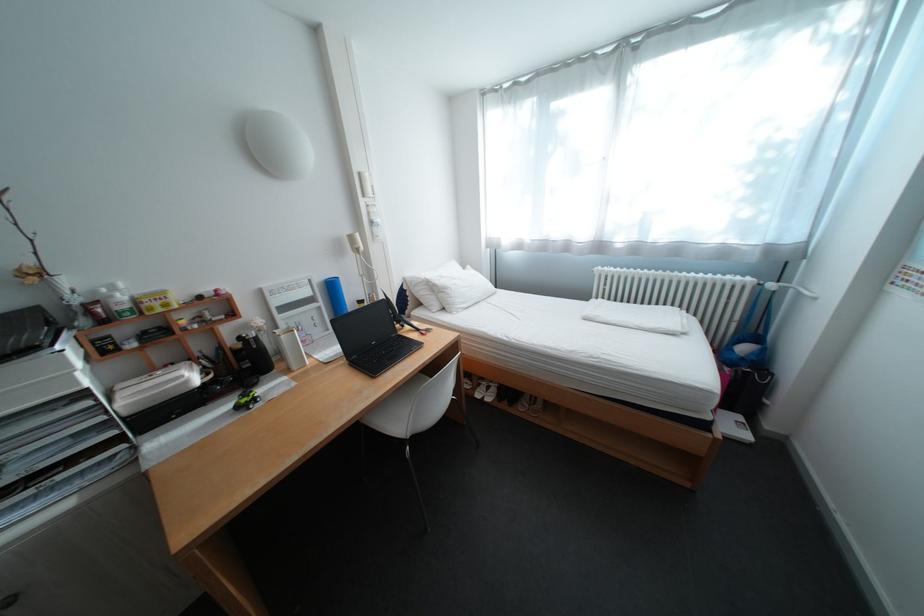
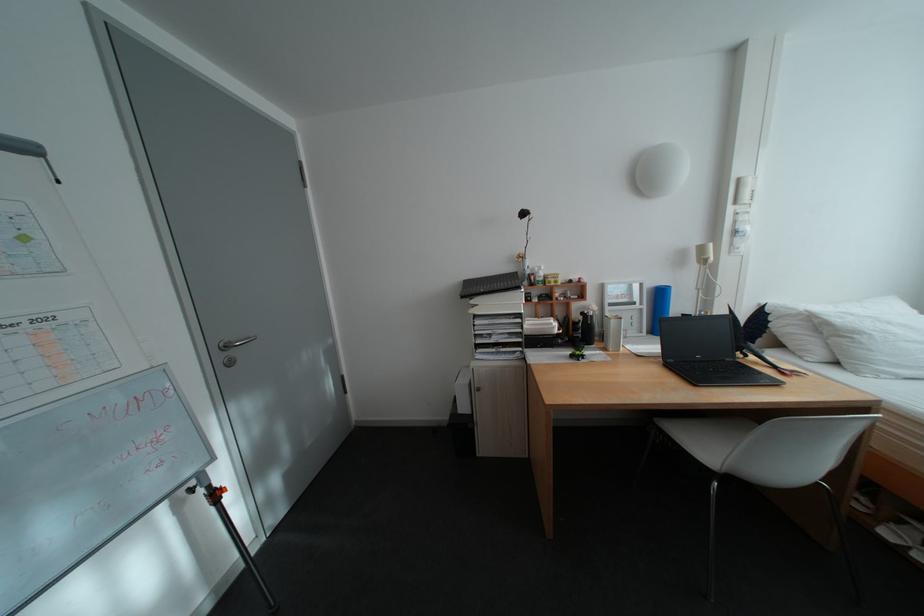
Locate, in the second image, the point that corresponds to (x=459, y=290) in the first image.

(871, 334)